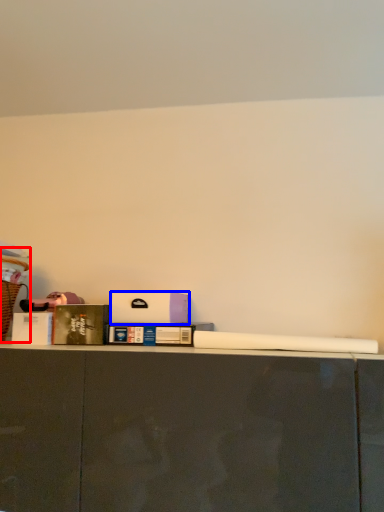
Question: Which point is further to the camera, laundry basket (highlighted by a red box) or box (highlighted by a blue box)?

Choices:
 (A) laundry basket
 (B) box

Answer: (B)